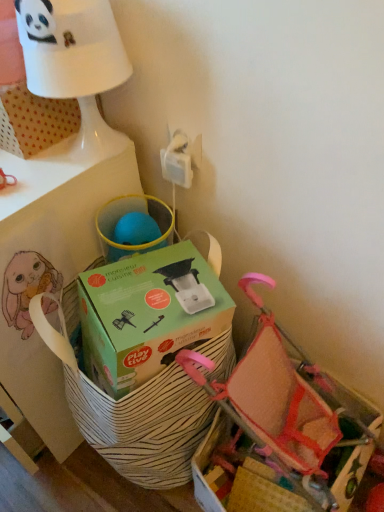
Question: Are white glossy table lamp at upper left and white matte table at upper left making contact?

Choices:
 (A) yes
 (B) no

Answer: (B)

Question: Is white glossy table lamp at upper left aimed at white matte table at upper left?

Choices:
 (A) no
 (B) yes

Answer: (A)

Question: From the image's perspective, is white glossy table lamp at upper left located beneath white matte table at upper left?

Choices:
 (A) yes
 (B) no

Answer: (B)

Question: From a real-world perspective, is white glossy table lamp at upper left on white matte table at upper left?

Choices:
 (A) yes
 (B) no

Answer: (A)

Question: From the image's perspective, is white glossy table lamp at upper left above white matte table at upper left?

Choices:
 (A) no
 (B) yes

Answer: (B)

Question: Is white glossy table lamp at upper left looking in the opposite direction of white matte table at upper left?

Choices:
 (A) yes
 (B) no

Answer: (B)

Question: Is white glossy table lamp at upper left at the left side of green cardboard box at center?

Choices:
 (A) no
 (B) yes

Answer: (B)

Question: Can you confirm if white glossy table lamp at upper left is shorter than green cardboard box at center?

Choices:
 (A) yes
 (B) no

Answer: (B)

Question: Is white glossy table lamp at upper left bigger than green cardboard box at center?

Choices:
 (A) yes
 (B) no

Answer: (B)

Question: Is white glossy table lamp at upper left smaller than green cardboard box at center?

Choices:
 (A) no
 (B) yes

Answer: (B)

Question: From a real-world perspective, is white glossy table lamp at upper left positioned under green cardboard box at center based on gravity?

Choices:
 (A) no
 (B) yes

Answer: (A)

Question: Considering the relative sizes of white glossy table lamp at upper left and green cardboard box at center in the image provided, is white glossy table lamp at upper left thinner than green cardboard box at center?

Choices:
 (A) no
 (B) yes

Answer: (B)

Question: Considering the relative positions of white matte table at upper left and pink mesh baby carriage at lower right in the image provided, is white matte table at upper left to the right of pink mesh baby carriage at lower right from the viewer's perspective?

Choices:
 (A) yes
 (B) no

Answer: (B)